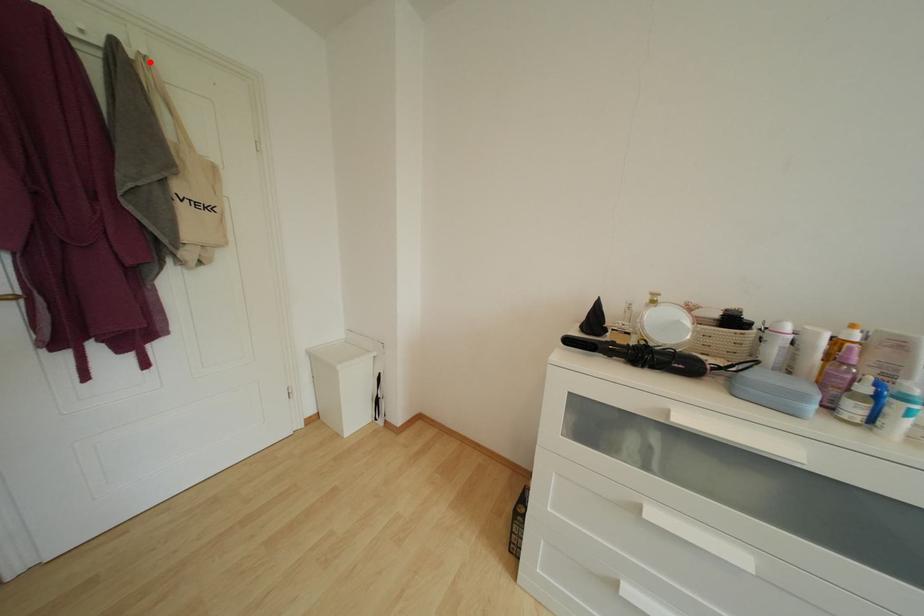
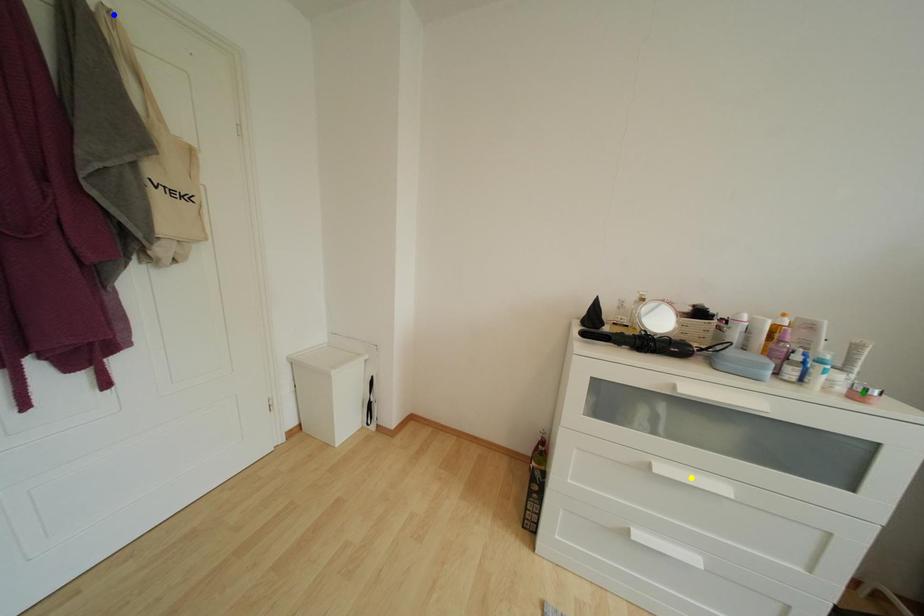
Question: I am providing you with two images of the same scene from different viewpoints. A red point is marked on the first image. You are given multiple points on the second image. In image 2, which mark is for the same physical point as the one in image 1?

Choices:
 (A) blue point
 (B) green point
 (C) yellow point

Answer: (A)